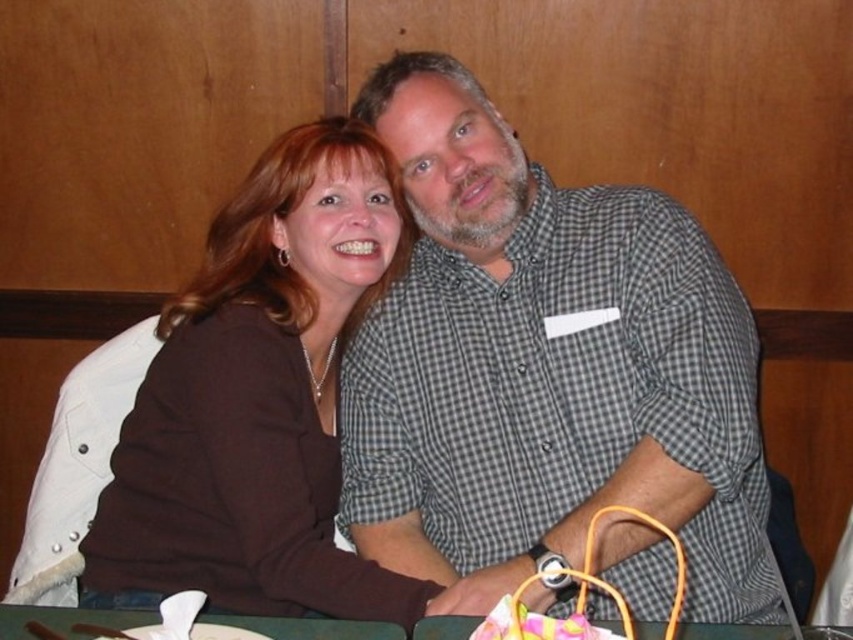
Question: Does gray checkered shirt at center lie in front of green fabric table at lower center?

Choices:
 (A) yes
 (B) no

Answer: (B)

Question: Does gray checkered shirt at center come behind green fabric table at lower center?

Choices:
 (A) no
 (B) yes

Answer: (B)

Question: Estimate the real-world distances between objects in this image. Which object is closer to the green fabric table at lower center?

Choices:
 (A) brown matte sweater at center
 (B) gray checkered shirt at center

Answer: (A)

Question: Which point is farther from the camera taking this photo?

Choices:
 (A) (82, 634)
 (B) (503, 444)
 (C) (227, 502)

Answer: (B)

Question: Which object is positioned closest to the green fabric table at lower center?

Choices:
 (A) brown matte sweater at center
 (B) gray checkered shirt at center

Answer: (A)

Question: Is gray checkered shirt at center bigger than green fabric table at lower center?

Choices:
 (A) yes
 (B) no

Answer: (A)